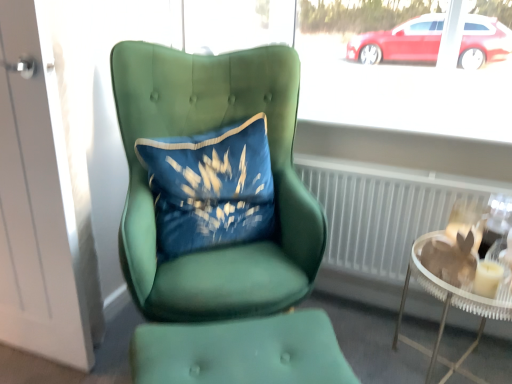
In order to click on green fabric footrest at lower center in this screenshot , I will do `click(241, 351)`.

Identify the location of clear glass table at lower right. This screenshot has height=384, width=512. (450, 305).

Identify the location of translucent glass candle at right. The height and width of the screenshot is (384, 512). (488, 278).

What do you see at coordinates (383, 210) in the screenshot? I see `white textured radiator at center` at bounding box center [383, 210].

Identify the location of velvet green chair at center. (225, 247).

Is white matte door at left a part of velvet blue pillow at center?

Actually, white matte door at left is outside velvet blue pillow at center.

Which is more to the left, velvet blue pillow at center or white matte door at left?

white matte door at left.

Identify the location of pillow behind the white matte door at left. (210, 188).

How far apart are velvet blue pillow at center and white matte door at left?

velvet blue pillow at center is 15.80 inches from white matte door at left.

Is clear glass table at lower right beside velvet green chair at center?

No.

Where is `chair that is on the left side of clear glass table at lower right`? chair that is on the left side of clear glass table at lower right is located at coordinates (225, 247).

Is clear glass table at lower right facing away from velvet green chair at center?

No, clear glass table at lower right is not facing the opposite direction of velvet green chair at center.

Can we say clear glass table at lower right lies outside velvet green chair at center?

Yes, clear glass table at lower right is outside of velvet green chair at center.

From the picture: Is velvet blue pillow at center outside of clear glass table at lower right?

velvet blue pillow at center lies outside clear glass table at lower right's area.

From a real-world perspective, is velvet blue pillow at center above or below clear glass table at lower right?

velvet blue pillow at center is above clear glass table at lower right.

Which is behind, point (158, 257) or point (440, 238)?

Point (158, 257)

Considering the positions of objects velvet blue pillow at center and clear glass table at lower right in the image provided, who is more to the right, velvet blue pillow at center or clear glass table at lower right?

Positioned to the right is clear glass table at lower right.

Is point (476, 276) closer or farther from the camera than point (321, 175)?

Point (476, 276) appears to be closer to the viewer than point (321, 175).

At what (x,y) coordinates should I click in order to perform the action: click on candle holder in front of the white textured radiator at center. Please return your answer as a coordinate pair (x, y). The image size is (512, 384). Looking at the image, I should click on (488, 278).

Is translucent glass candle at right positioned beyond the bounds of white textured radiator at center?

Absolutely, translucent glass candle at right is external to white textured radiator at center.

Between white matte door at left and velvet blue pillow at center, which one has more height?

white matte door at left.

From a real-world perspective, which object stands above the other?

velvet blue pillow at center is physically above.

Does white matte door at left have a lesser width compared to velvet blue pillow at center?

Yes.

Based on the photo, from the image's perspective, is velvet green chair at center positioned above or below white matte door at left?

Based on their image positions, velvet green chair at center is located beneath white matte door at left.

Can you confirm if velvet green chair at center is smaller than white matte door at left?

Actually, velvet green chair at center might be larger than white matte door at left.

Based on the photo, can you tell me how much velvet green chair at center and white matte door at left differ in facing direction?

The angle between the facing direction of velvet green chair at center and the facing direction of white matte door at left is 34.5 degrees.

From a real-world perspective, between velvet green chair at center and white matte door at left, who is vertically higher?

In real-world perspective, white matte door at left is above.

Does velvet blue pillow at center have a greater height compared to translucent glass candle at right?

Yes.

How far apart are velvet blue pillow at center and translucent glass candle at right?

velvet blue pillow at center and translucent glass candle at right are 32.07 inches apart.

How different are the orientations of velvet blue pillow at center and translucent glass candle at right in degrees?

The facing directions of velvet blue pillow at center and translucent glass candle at right are 65.9 degrees apart.

From the picture: Considering the sizes of objects velvet blue pillow at center and translucent glass candle at right in the image provided, who is smaller, velvet blue pillow at center or translucent glass candle at right?

translucent glass candle at right is smaller.

Identify the location of pillow behind the white matte door at left. The width and height of the screenshot is (512, 384). (210, 188).

Where is `table on the right of velvet green chair at center`? table on the right of velvet green chair at center is located at coordinates (450, 305).

Looking at this image, considering their positions, is velvet blue pillow at center positioned closer to green fabric footrest at lower center than white textured radiator at center?

velvet blue pillow at center is positioned closer to the anchor green fabric footrest at lower center.

Consider the image. Considering their positions, is velvet blue pillow at center positioned further to velvet green chair at center than translucent glass candle at right?

translucent glass candle at right is positioned further to the anchor velvet green chair at center.

Estimate the real-world distances between objects in this image. Which object is further from white textured radiator at center, clear glass table at lower right or velvet green chair at center?

Based on the image, velvet green chair at center appears to be further to white textured radiator at center.

Based on their spatial positions, is clear glass table at lower right or velvet blue pillow at center further from translucent glass candle at right?

velvet blue pillow at center is positioned further to the anchor translucent glass candle at right.

Based on their spatial positions, is velvet green chair at center or white matte door at left closer to green fabric footrest at lower center?

Among the two, velvet green chair at center is located nearer to green fabric footrest at lower center.

From the image, which object appears to be nearer to white textured radiator at center, green fabric footrest at lower center or white matte door at left?

Among the two, green fabric footrest at lower center is located nearer to white textured radiator at center.

Estimate the real-world distances between objects in this image. Which object is closer to white textured radiator at center, velvet blue pillow at center or white matte door at left?

Based on the image, velvet blue pillow at center appears to be nearer to white textured radiator at center.

Estimate the real-world distances between objects in this image. Which object is further from clear glass table at lower right, white matte door at left or green fabric footrest at lower center?

Based on the image, white matte door at left appears to be further to clear glass table at lower right.

Where is `the footrest located between velvet blue pillow at center and white textured radiator at center in the left-right direction`? the footrest located between velvet blue pillow at center and white textured radiator at center in the left-right direction is located at coordinates (241, 351).

Identify the location of the footrest located between velvet green chair at center and white textured radiator at center in the left-right direction. This screenshot has width=512, height=384. click(241, 351).

The height and width of the screenshot is (384, 512). What are the coordinates of `candle holder situated between velvet blue pillow at center and clear glass table at lower right from left to right` in the screenshot? It's located at (488, 278).

The image size is (512, 384). I want to click on screen door between velvet blue pillow at center and green fabric footrest at lower center from top to bottom, so click(x=42, y=201).